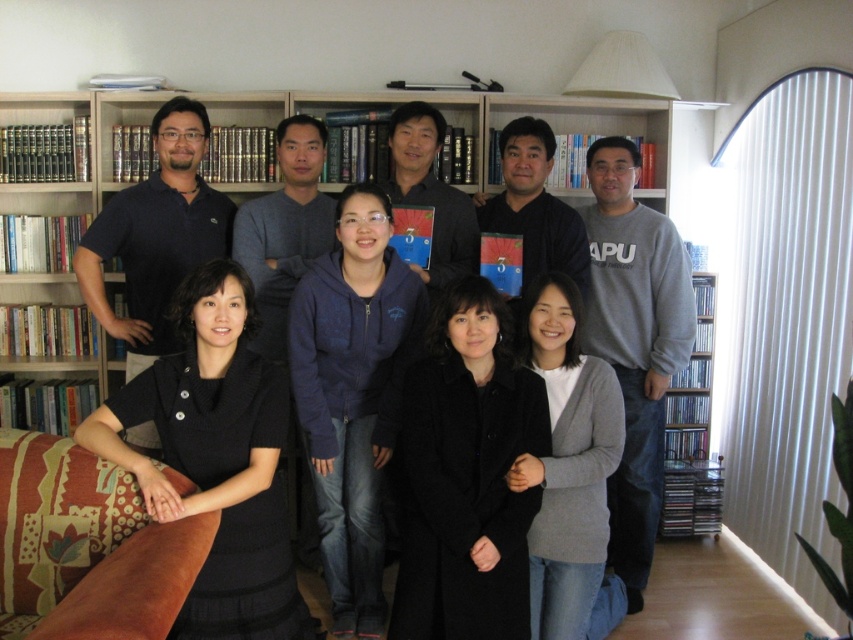
Question: Can you confirm if black knit dress at center is thinner than black matte jacket at center?

Choices:
 (A) yes
 (B) no

Answer: (B)

Question: Does gray cotton sweatshirt at right have a greater width compared to black matte jacket at center?

Choices:
 (A) yes
 (B) no

Answer: (B)

Question: Among these points, which one is nearest to the camera?

Choices:
 (A) (85, 280)
 (B) (596, 589)
 (C) (368, 529)
 (D) (624, 497)

Answer: (B)

Question: Estimate the real-world distances between objects in this image. Which object is closer to the gray cotton sweatshirt at right?

Choices:
 (A) dark blue fleece at center
 (B) black knit dress at center

Answer: (A)

Question: Which point appears closest to the camera in this image?

Choices:
 (A) (543, 132)
 (B) (358, 620)

Answer: (B)

Question: Is black wool coat at center thinner than black matte jacket at center?

Choices:
 (A) yes
 (B) no

Answer: (B)